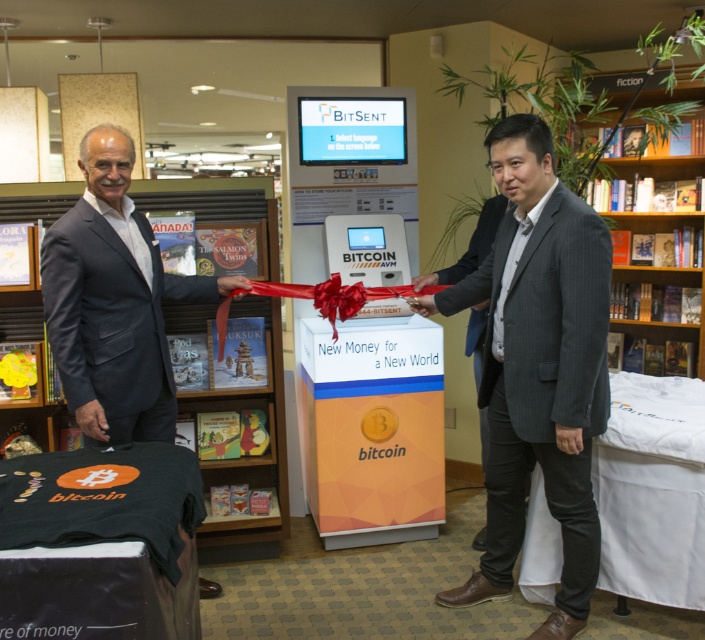
You are a photographer positioned at the back of the bookstore. You want to take a photo of the black suit at left and the red silk ribbon at center. Which object will appear larger in the photo?

The black suit at left appears larger in the photo because it has a greater height compared to the red silk ribbon at center.

You are a photographer taking a picture of the Bitcoin ATM machine. You notice a point at coordinates (114, 301). Where is this point located in relation to the black suit at left?

The point at coordinates (114, 301) is located on the black suit at left.